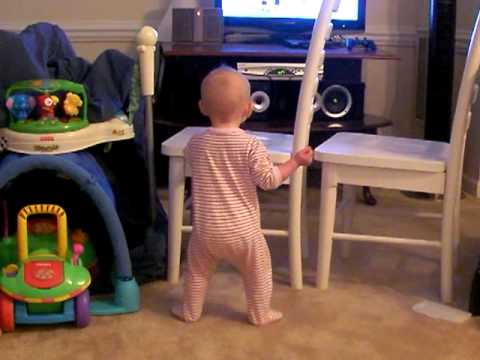
Find the location of a particular element. This screenshot has width=480, height=360. toy is located at coordinates (62, 178).